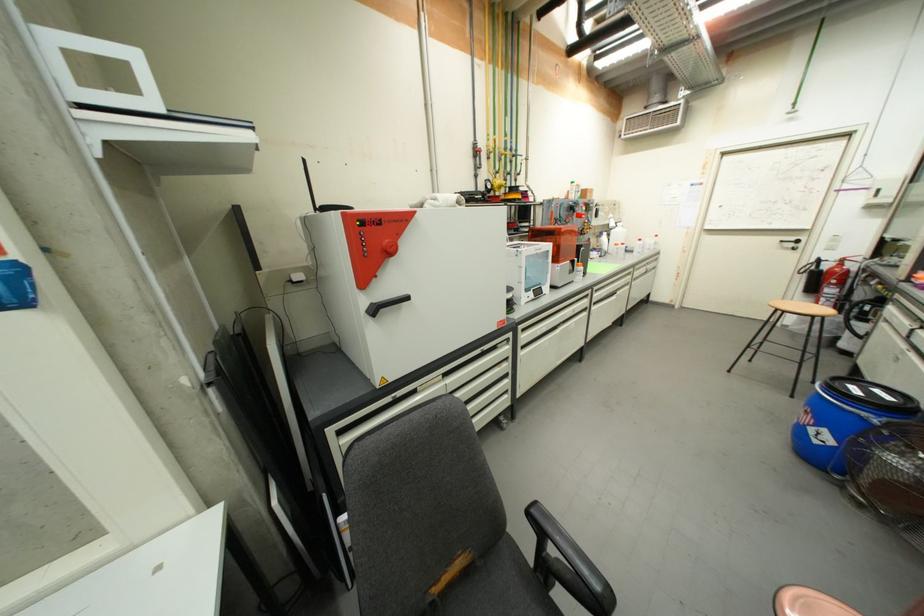
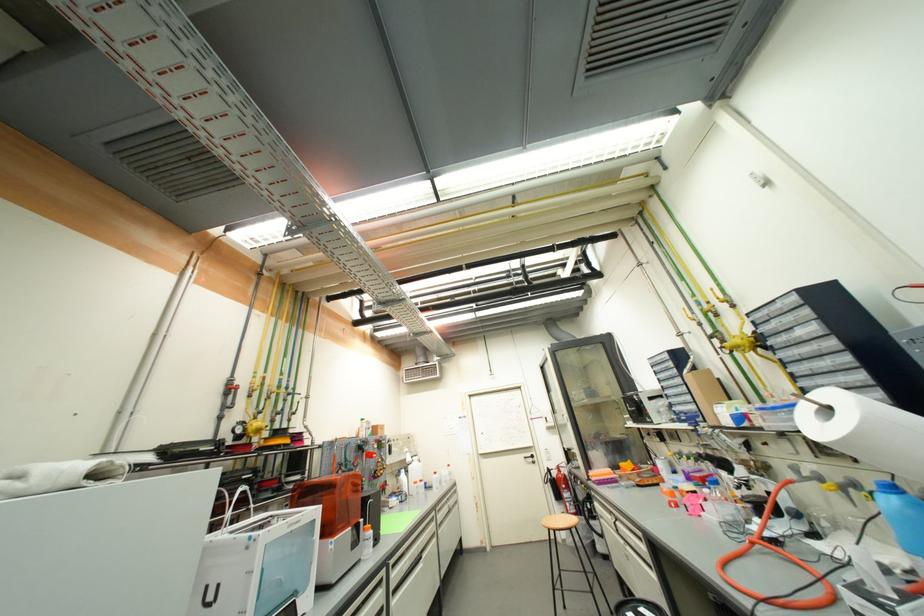
Where in the second image is the point corresponding to point (828, 261) from the first image?

(554, 469)